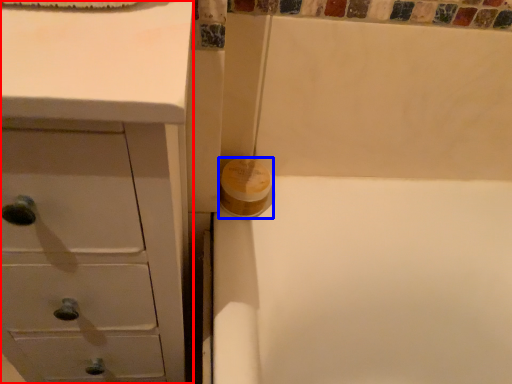
Question: Among these objects, which one is farthest to the camera, chest of drawers (highlighted by a red box) or toilet paper (highlighted by a blue box)?

Choices:
 (A) chest of drawers
 (B) toilet paper

Answer: (B)